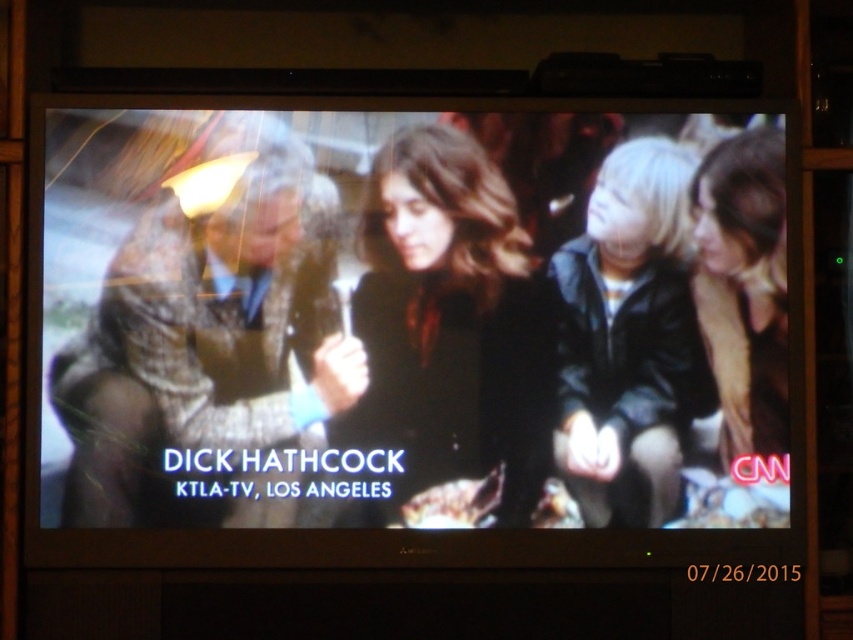
You are a camera operator adjusting focus on the television screen. You notice two points of interest marked as point 1 at coordinates point (294, 348) and point 2 at coordinates point (456, 458). Which point should you focus on first if you want to ensure the closest object to the camera is in focus?

Point (294, 348) is further to the camera than point (456, 458), so you should focus on point (294, 348) first to ensure the closest object is in focus.

You are watching the news and notice two coats on the screen. The brown textured coat at left and the black leather jacket at right. Which one is larger in size?

The brown textured coat at left is bigger than the black leather jacket at right, so the brown textured coat at left is larger in size.

You are watching the news on the TV and see the reporter DICK HATHCO. You notice two pieces of clothing on the screen, the matte black jacket at center and the brown textured coat at left. Which clothing item is closer to the camera?

The matte black jacket at center is closer to the camera because it is in front of the brown textured coat at left.